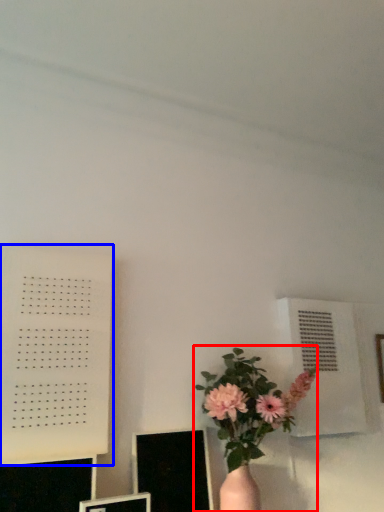
Question: Among these objects, which one is nearest to the camera, houseplant (highlighted by a red box) or bulletin board (highlighted by a blue box)?

Choices:
 (A) houseplant
 (B) bulletin board

Answer: (A)